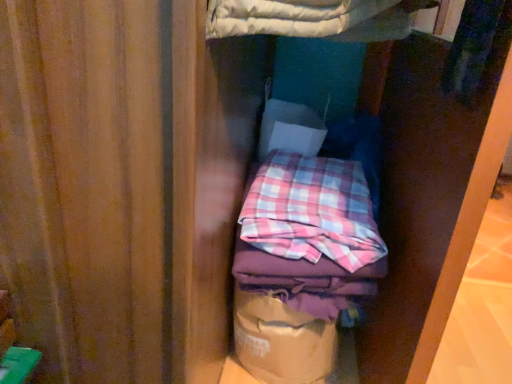
Question: In terms of size, does pink plaid fabric at center appear bigger or smaller than brown paper bag at center?

Choices:
 (A) big
 (B) small

Answer: (A)

Question: From the image's perspective, relative to brown paper bag at center, is pink plaid fabric at center above or below?

Choices:
 (A) above
 (B) below

Answer: (A)

Question: Based on their positions, is pink plaid fabric at center located to the left or right of brown paper bag at center?

Choices:
 (A) left
 (B) right

Answer: (B)

Question: Considering the relative positions of brown paper bag at center and pink plaid fabric at center in the image provided, is brown paper bag at center to the left or to the right of pink plaid fabric at center?

Choices:
 (A) right
 (B) left

Answer: (B)

Question: From a real-world perspective, is brown paper bag at center positioned above or below pink plaid fabric at center?

Choices:
 (A) above
 (B) below

Answer: (B)

Question: Is point (330, 340) closer or farther from the camera than point (322, 188)?

Choices:
 (A) farther
 (B) closer

Answer: (A)

Question: Is brown paper bag at center in front of or behind pink plaid fabric at center in the image?

Choices:
 (A) front
 (B) behind

Answer: (B)